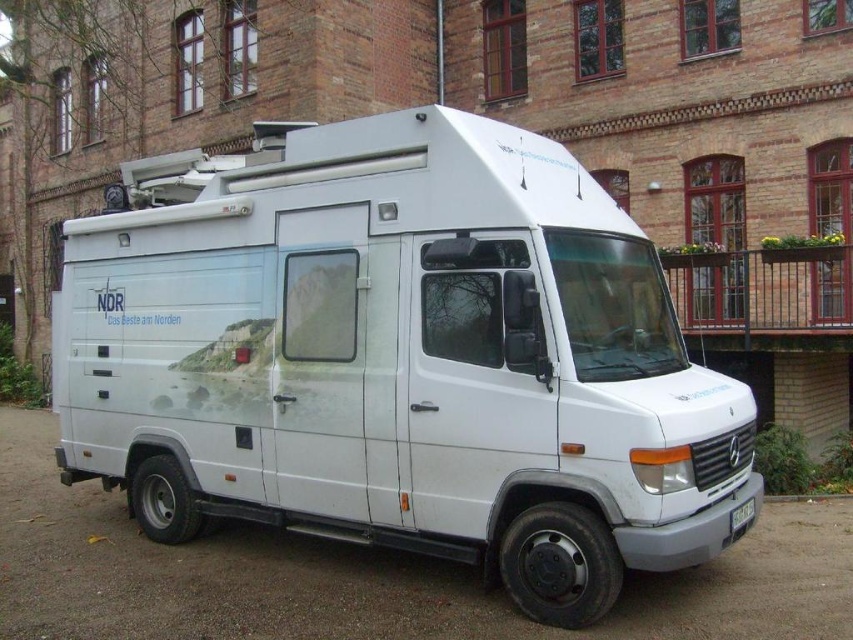
You are a photographer standing in front of the white glossy van at center and the white plastic license plate at center. You want to take a photo that captures both objects in the frame. Which object should you focus on to ensure both are fully visible?

You should focus on the white glossy van at center because it is wider than the white plastic license plate at center, so centering the van will likely keep the license plate within the frame as well.

You are standing in front of the white Mercedes van parked in front of the brick building. You notice two points marked on the van. The first point is at coordinate point (263, 336) and the second point is at coordinate point (750, 518). From your perspective, which point is closer to you?

Point (750, 518) is closer to you because it is in front of point (263, 336).